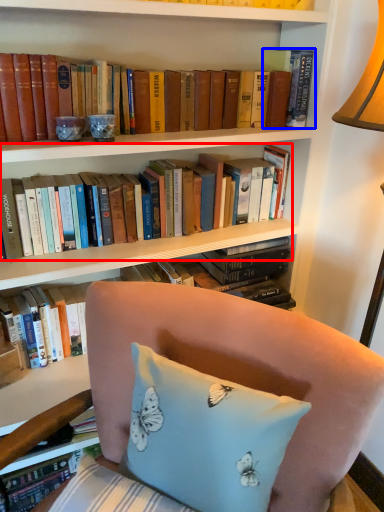
Question: Which point is further to the camera, book (highlighted by a red box) or book (highlighted by a blue box)?

Choices:
 (A) book
 (B) book

Answer: (B)